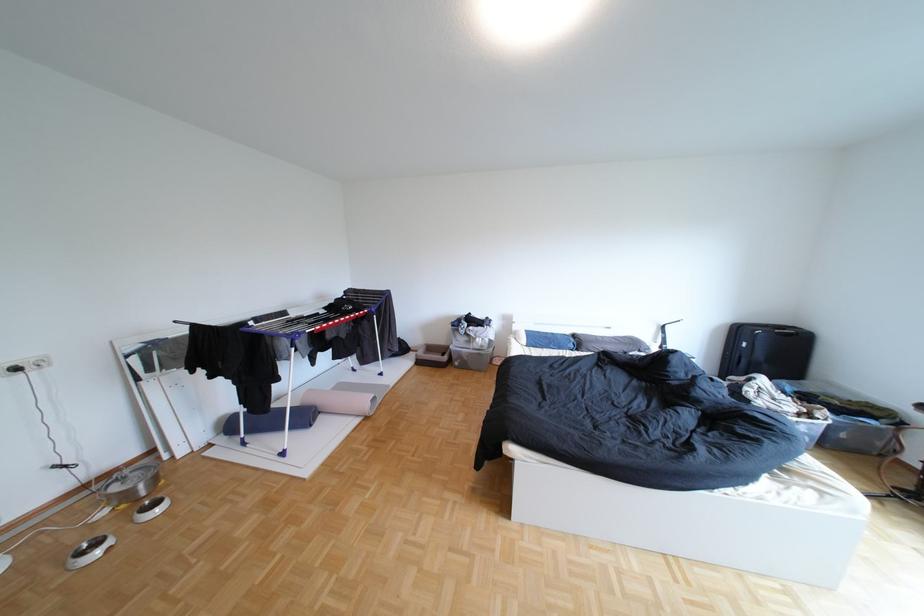
What do you see at coordinates (785, 331) in the screenshot? Image resolution: width=924 pixels, height=616 pixels. I see `the black suitcase handle` at bounding box center [785, 331].